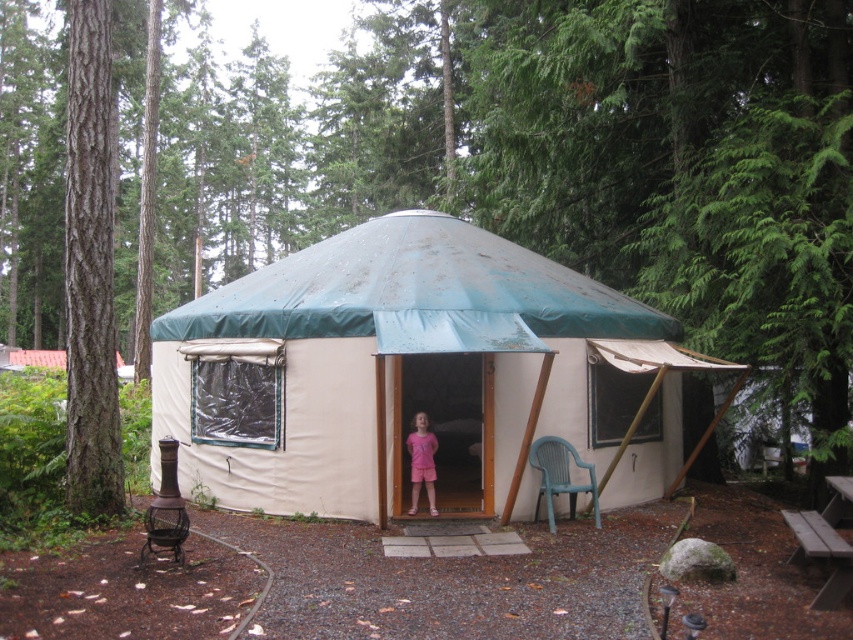
Question: Which object is the farthest from the blue plastic chair at lower right?

Choices:
 (A) teal fabric canopy at center
 (B) smooth brown bark at left

Answer: (B)

Question: Which object appears closest to the camera in this image?

Choices:
 (A) smooth brown bark at left
 (B) pink fabric dress at center
 (C) teal fabric canopy at center
 (D) blue plastic chair at lower right

Answer: (C)

Question: Is teal fabric canopy at center above smooth brown bark at left?

Choices:
 (A) no
 (B) yes

Answer: (A)

Question: Can you confirm if white canvas tent at center is positioned above smooth brown bark at left?

Choices:
 (A) no
 (B) yes

Answer: (A)

Question: Based on their relative distances, which object is nearer to the teal fabric canopy at center?

Choices:
 (A) white canvas tent at center
 (B) smooth brown bark at left
 (C) blue plastic chair at lower right

Answer: (C)

Question: Does wooden picnic table at lower right appear over pink fabric dress at center?

Choices:
 (A) yes
 (B) no

Answer: (B)